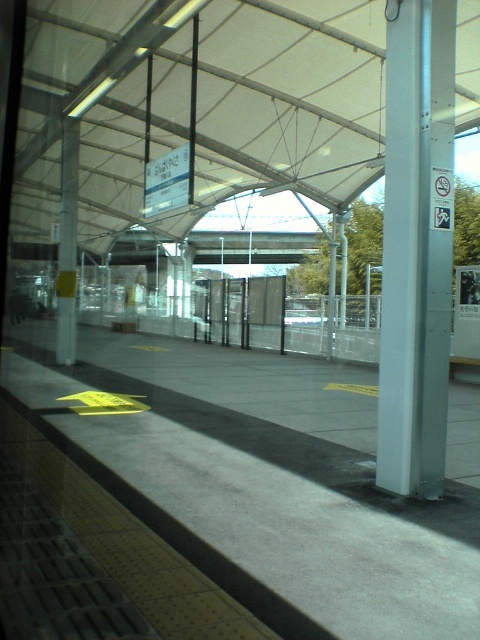
Question: Is white fabric canopy at upper center wider than silver metallic pole at right?

Choices:
 (A) no
 (B) yes

Answer: (B)

Question: Can you confirm if white fabric canopy at upper center is positioned to the left of silver metallic pole at right?

Choices:
 (A) yes
 (B) no

Answer: (A)

Question: Is white fabric canopy at upper center positioned at the back of silver metallic pole at right?

Choices:
 (A) yes
 (B) no

Answer: (A)

Question: Which point is farther from the camera taking this photo?

Choices:
 (A) (402, 60)
 (B) (22, 161)

Answer: (B)

Question: Which object is farther from the camera taking this photo?

Choices:
 (A) silver metallic pole at right
 (B) white fabric canopy at upper center

Answer: (B)